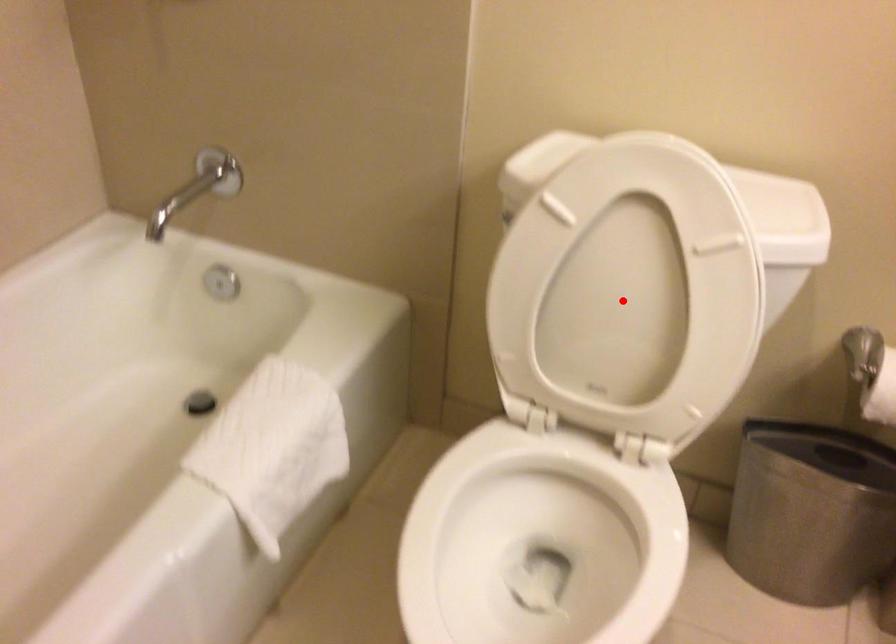
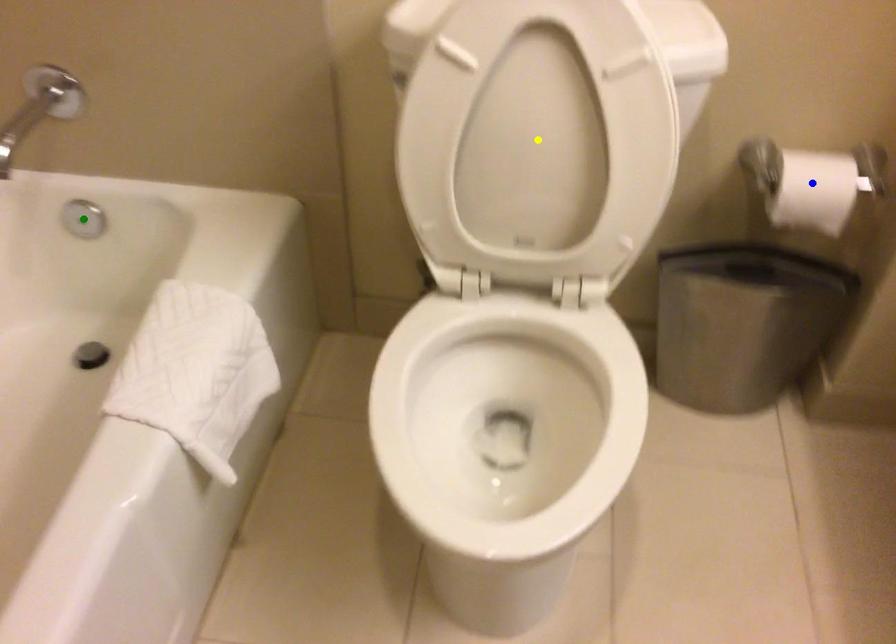
Question: I am providing you with two images of the same scene from different viewpoints. A red point is marked on the first image. You are given multiple points on the second image. Which point in image 2 represents the same 3d spot as the red point in image 1?

Choices:
 (A) blue point
 (B) yellow point
 (C) green point

Answer: (B)